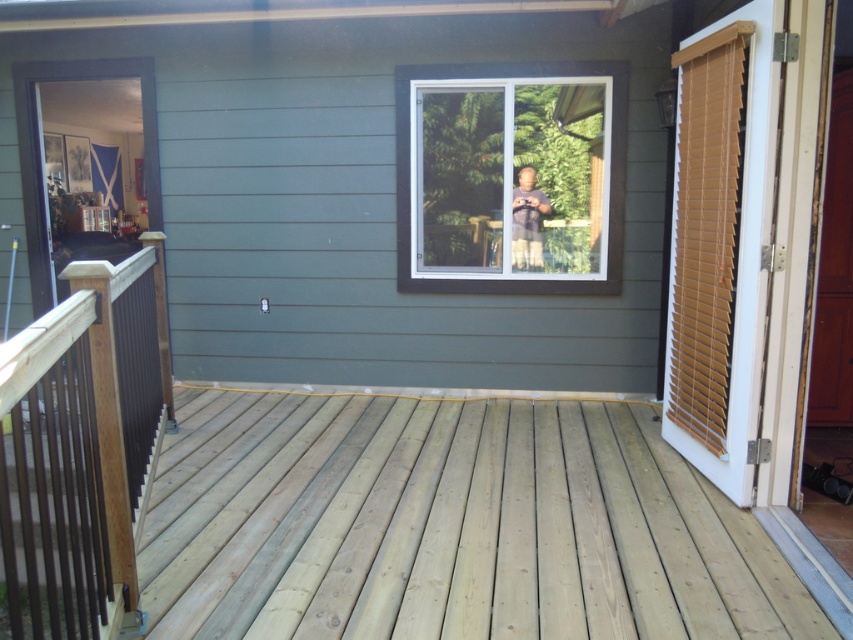
Is white plastic window at center to the left of tan wood blinds at right from the viewer's perspective?

Yes, white plastic window at center is to the left of tan wood blinds at right.

Between white plastic window at center and tan wood blinds at right, which one has less height?

With less height is white plastic window at center.

Between point (552, 113) and point (694, 332), which one is positioned in front?

Positioned in front is point (694, 332).

Image resolution: width=853 pixels, height=640 pixels. Identify the location of white plastic window at center. (509, 177).

Does tan wood blinds at right have a lesser width compared to matte black phone at center?

Yes.

Who is positioned more to the right, tan wood blinds at right or matte black phone at center?

tan wood blinds at right

Where is `tan wood blinds at right`? This screenshot has height=640, width=853. tan wood blinds at right is located at coordinates (720, 246).

Which of these two, natural wood deck at center or matte black phone at center, stands shorter?

Standing shorter between the two is natural wood deck at center.

Can you confirm if natural wood deck at center is smaller than matte black phone at center?

No.

Who is more distant from viewer, (793, 612) or (532, 205)?

The point (532, 205) is behind.

You are a GUI agent. You are given a task and a screenshot of the screen. Output one action in this format:
    pyautogui.click(x=<x>, y=<y>)
    Task: Click on the natural wood deck at center
    The image size is (853, 640).
    Given the screenshot: What is the action you would take?
    [448, 525]